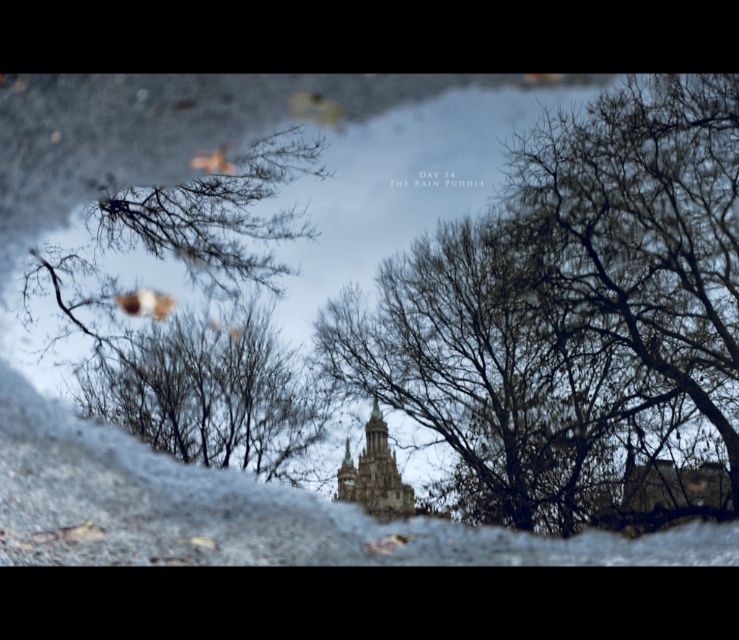
Does brown matte tree at center come behind golden stone bell tower at center?

No, it is not.

Where is `brown matte tree at center`? This screenshot has height=640, width=739. brown matte tree at center is located at coordinates (207, 392).